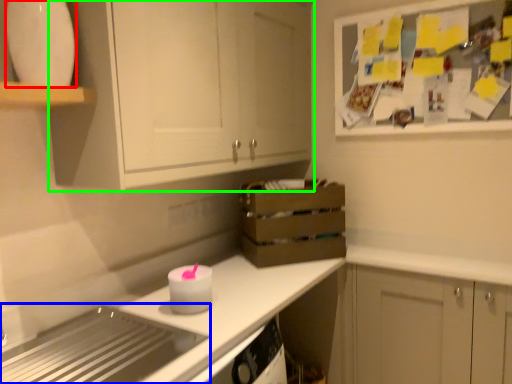
Question: Which is farther away from appliance (highlighted by a red box)? appliance (highlighted by a blue box) or cabinetry (highlighted by a green box)?

Choices:
 (A) appliance
 (B) cabinetry

Answer: (A)